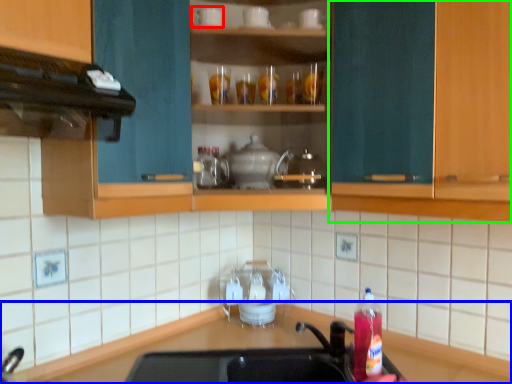
Question: Considering the real-world distances, which object is closest to appliance (highlighted by a red box)? countertop (highlighted by a blue box) or cabinetry (highlighted by a green box).

Choices:
 (A) countertop
 (B) cabinetry

Answer: (B)